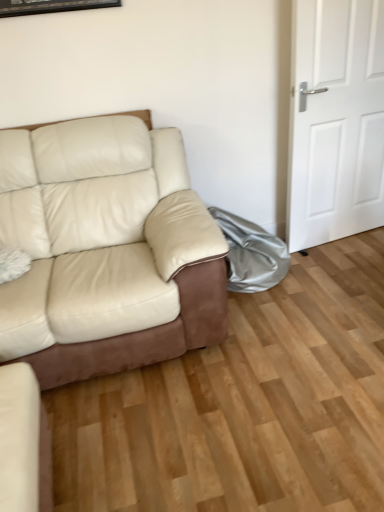
Question: From a real-world perspective, is leather couch at lower left, positioned as the second studio couch in top-to-bottom order, below silver metallic bag at lower right?

Choices:
 (A) yes
 (B) no

Answer: (A)

Question: Considering the relative positions of leather couch at lower left, positioned as the first studio couch in bottom-to-top order, and silver metallic bag at lower right in the image provided, is leather couch at lower left, positioned as the first studio couch in bottom-to-top order, behind silver metallic bag at lower right?

Choices:
 (A) yes
 (B) no

Answer: (B)

Question: Is leather couch at lower left, positioned as the second studio couch in top-to-bottom order, bigger than silver metallic bag at lower right?

Choices:
 (A) no
 (B) yes

Answer: (A)

Question: Is leather couch at lower left, positioned as the second studio couch in top-to-bottom order, far from silver metallic bag at lower right?

Choices:
 (A) no
 (B) yes

Answer: (B)

Question: Considering the relative sizes of leather couch at lower left, positioned as the first studio couch in bottom-to-top order, and silver metallic bag at lower right in the image provided, is leather couch at lower left, positioned as the first studio couch in bottom-to-top order, thinner than silver metallic bag at lower right?

Choices:
 (A) yes
 (B) no

Answer: (A)

Question: From their relative heights in the image, would you say beige leather couch at left, marked as the first studio couch in a top-to-bottom arrangement, is taller or shorter than leather couch at lower left, positioned as the first studio couch in bottom-to-top order?

Choices:
 (A) short
 (B) tall

Answer: (B)

Question: Is point (39, 295) closer or farther from the camera than point (38, 385)?

Choices:
 (A) farther
 (B) closer

Answer: (B)

Question: Visually, is beige leather couch at left, marked as the 2th studio couch in a bottom-to-top arrangement, positioned to the left or to the right of leather couch at lower left, positioned as the second studio couch in top-to-bottom order?

Choices:
 (A) right
 (B) left

Answer: (A)

Question: Looking at the image, does beige leather couch at left, marked as the 2th studio couch in a bottom-to-top arrangement, seem bigger or smaller compared to leather couch at lower left, positioned as the second studio couch in top-to-bottom order?

Choices:
 (A) big
 (B) small

Answer: (A)

Question: From the image's perspective, is silver metallic bag at lower right positioned above or below white matte door at right?

Choices:
 (A) above
 (B) below

Answer: (B)

Question: From a real-world perspective, is silver metallic bag at lower right physically located above or below white matte door at right?

Choices:
 (A) below
 (B) above

Answer: (A)

Question: Is silver metallic bag at lower right bigger or smaller than white matte door at right?

Choices:
 (A) big
 (B) small

Answer: (B)

Question: In the image, is silver metallic bag at lower right on the left side or the right side of white matte door at right?

Choices:
 (A) right
 (B) left

Answer: (B)

Question: Is white matte door at right in front of or behind leather couch at lower left, positioned as the first studio couch in bottom-to-top order, in the image?

Choices:
 (A) behind
 (B) front

Answer: (A)

Question: Is white matte door at right inside the boundaries of leather couch at lower left, positioned as the second studio couch in top-to-bottom order, or outside?

Choices:
 (A) inside
 (B) outside

Answer: (B)